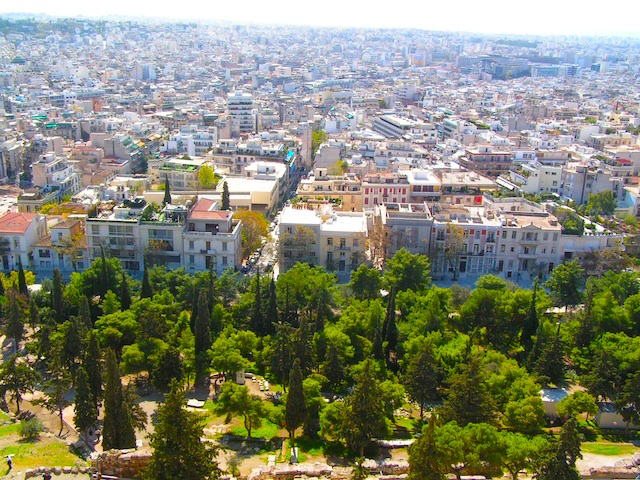
Where is `brick wall`? The height and width of the screenshot is (480, 640). brick wall is located at coordinates (141, 464), (297, 472), (390, 465), (611, 471).